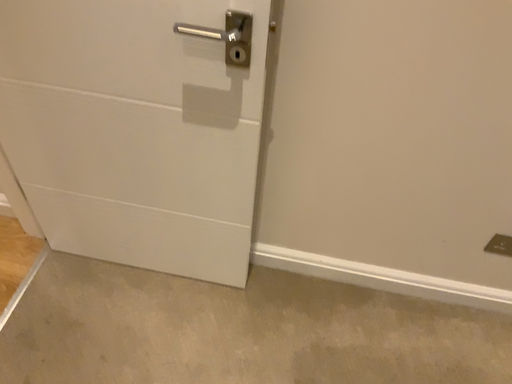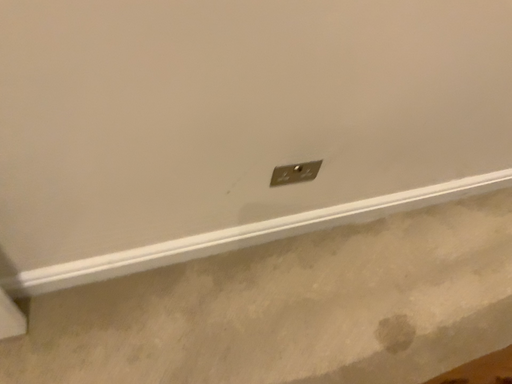
Question: Which way did the camera rotate in the video?

Choices:
 (A) rotated left
 (B) rotated right

Answer: (B)